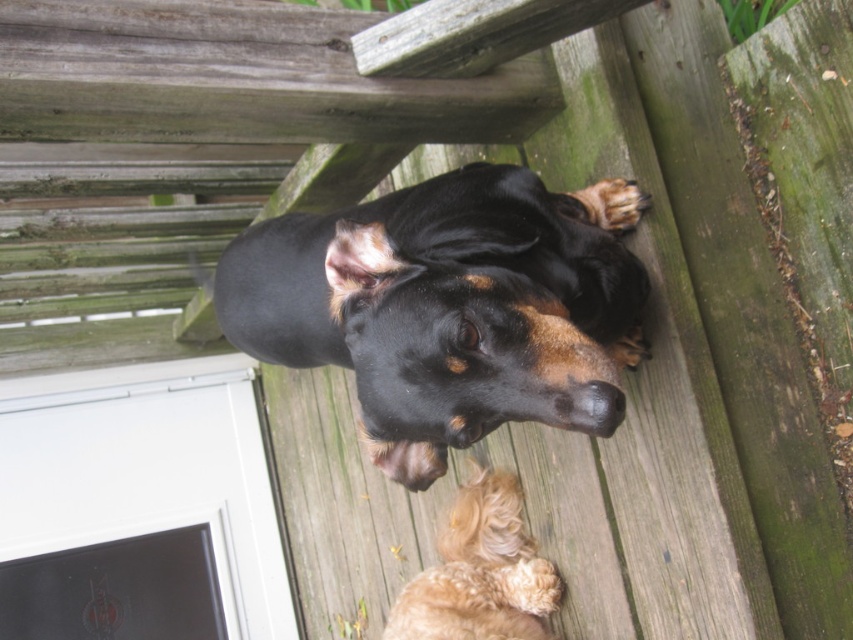
Question: Among these points, which one is nearest to the camera?

Choices:
 (A) (432, 600)
 (B) (233, 244)

Answer: (B)

Question: Among these objects, which one is farthest from the camera?

Choices:
 (A) golden fur dog at lower center
 (B) black shiny dog at upper center

Answer: (A)

Question: Does black shiny dog at upper center have a lesser width compared to golden fur dog at lower center?

Choices:
 (A) no
 (B) yes

Answer: (A)

Question: Does black shiny dog at upper center appear on the left side of golden fur dog at lower center?

Choices:
 (A) no
 (B) yes

Answer: (B)

Question: Can you confirm if black shiny dog at upper center is smaller than golden fur dog at lower center?

Choices:
 (A) yes
 (B) no

Answer: (B)

Question: Among these objects, which one is nearest to the camera?

Choices:
 (A) black shiny dog at upper center
 (B) golden fur dog at lower center

Answer: (A)